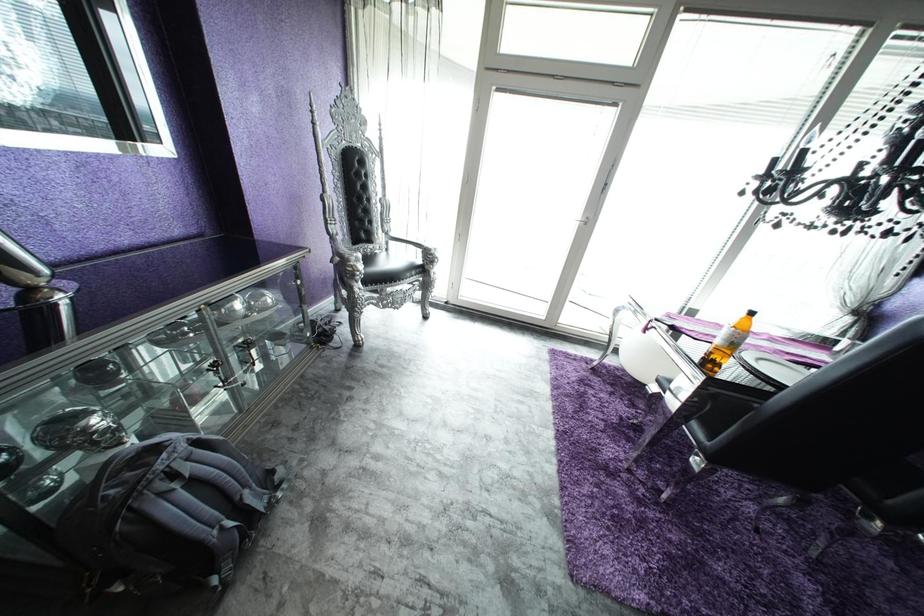
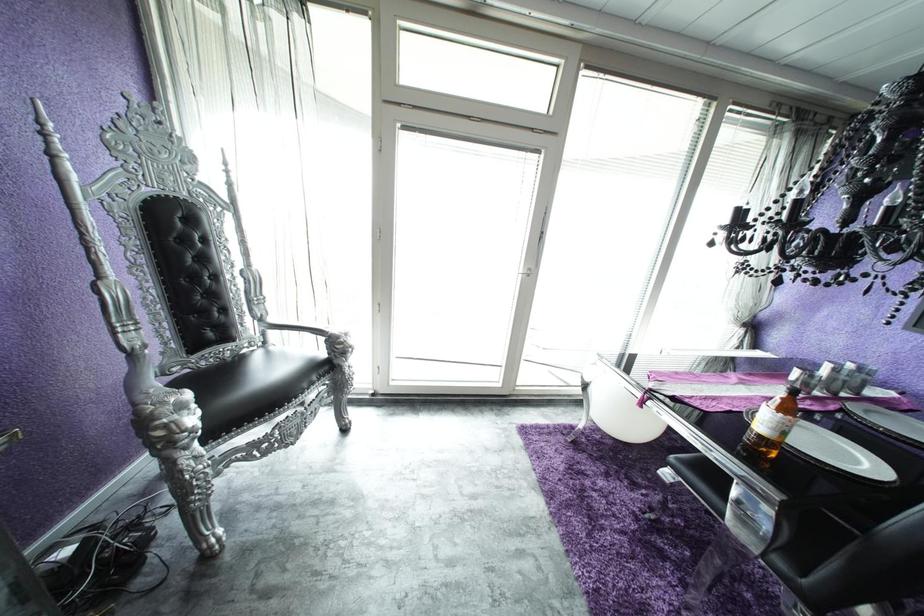
Question: Based on the continuous images, in which direction is the camera rotating? Reply with the corresponding letter.

Choices:
 (A) Left
 (B) Right
 (C) Up
 (D) Down

Answer: (B)